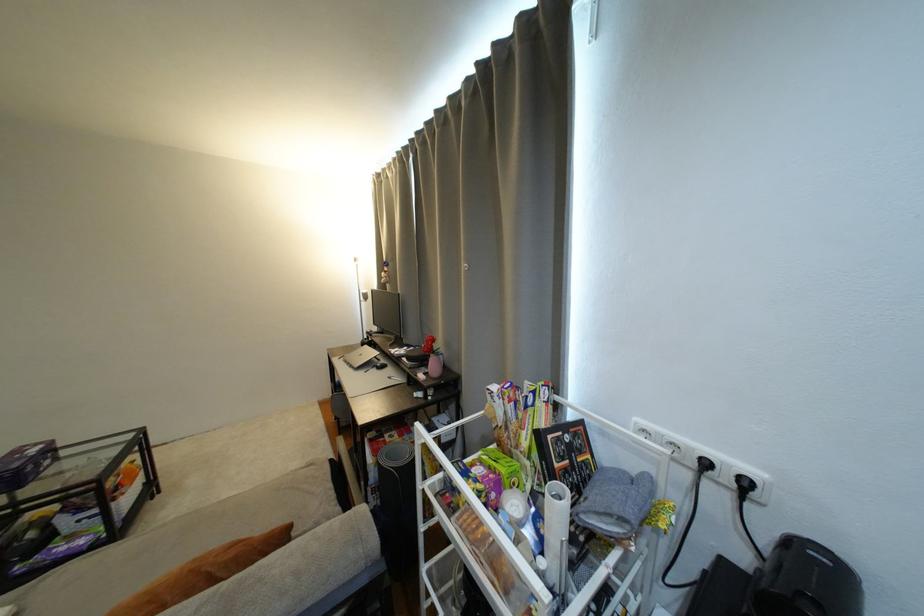
The width and height of the screenshot is (924, 616). Describe the element at coordinates (555, 533) in the screenshot. I see `the roll of tape` at that location.